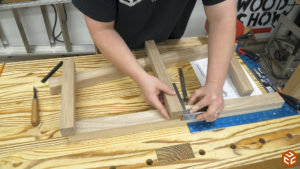
You are a GUI agent. You are given a task and a screenshot of the screen. Output one action in this format:
    pyautogui.click(x=<x>, y=<y>)
    Task: Click on the wood table
    The image size is (300, 169).
    Given the screenshot: What is the action you would take?
    pyautogui.click(x=22, y=94)